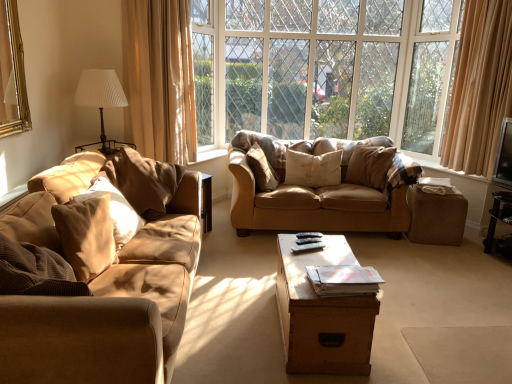
The image size is (512, 384). What are the coordinates of `vacant space to the right of wooden trunk at center` in the screenshot? It's located at (419, 329).